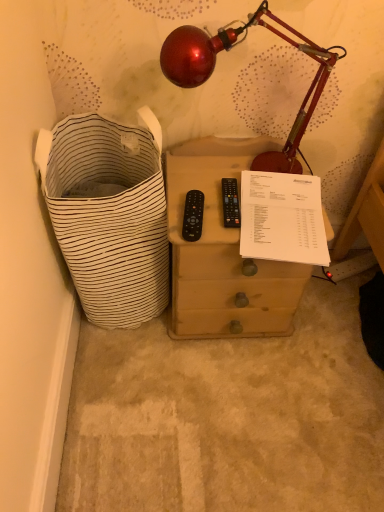
The height and width of the screenshot is (512, 384). Identify the location of vacant space to the right of black plastic remote at center, which ranks as the first control in right-to-left order. (280, 216).